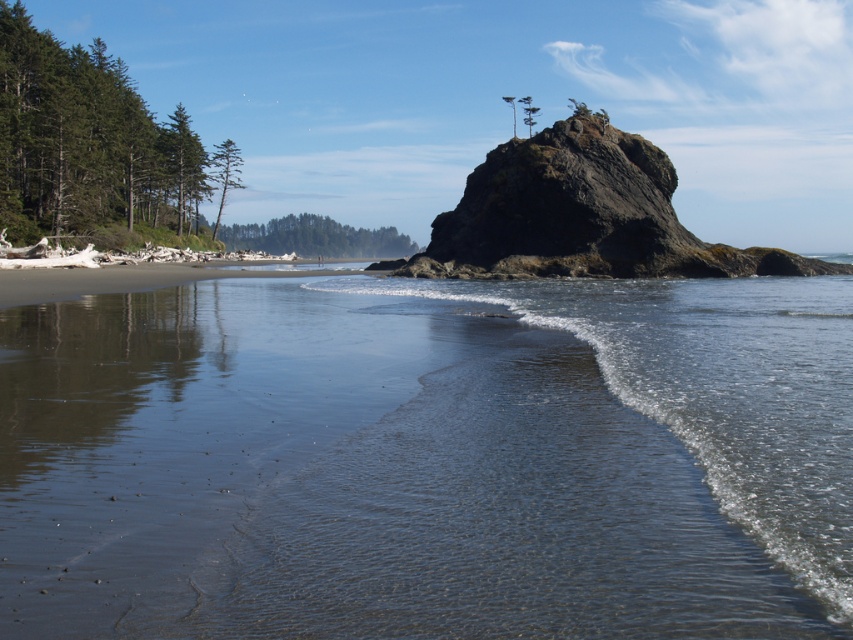
Question: From the image, what is the correct spatial relationship of clear water at center in relation to sandy beach at lower left?

Choices:
 (A) below
 (B) above

Answer: (A)

Question: Can you confirm if clear water at center is wider than sandy beach at lower left?

Choices:
 (A) yes
 (B) no

Answer: (A)

Question: Does clear water at center have a smaller size compared to rough textured rock at center?

Choices:
 (A) no
 (B) yes

Answer: (B)

Question: Which object is positioned closest to the rough textured rock at center?

Choices:
 (A) sandy beach at lower left
 (B) clear water at center

Answer: (A)

Question: Which of the following is the farthest from the observer?

Choices:
 (A) [x=352, y=272]
 (B) [x=440, y=436]

Answer: (A)

Question: Which point is farther from the camera taking this photo?

Choices:
 (A) pyautogui.click(x=611, y=444)
 (B) pyautogui.click(x=352, y=273)
 (C) pyautogui.click(x=514, y=273)

Answer: (B)